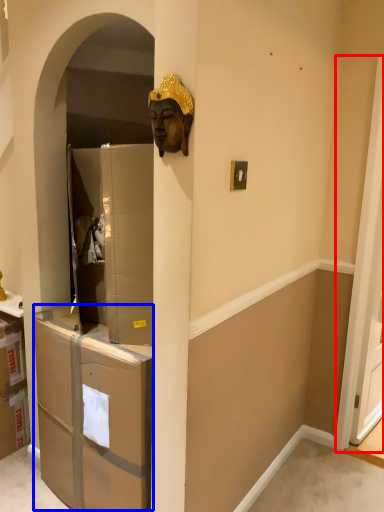
Question: Among these objects, which one is nearest to the camera, screen door (highlighted by a red box) or drawer (highlighted by a blue box)?

Choices:
 (A) screen door
 (B) drawer

Answer: (B)